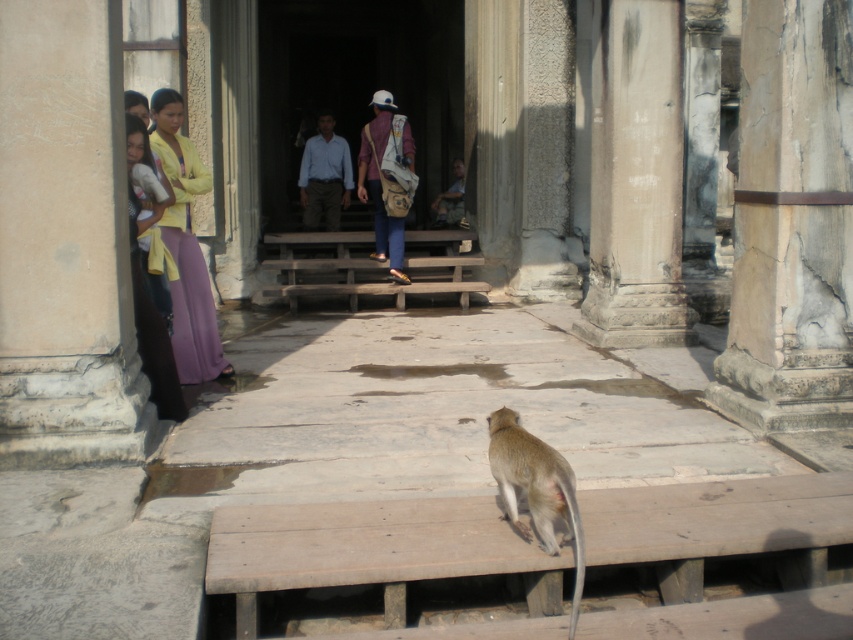
Does beige canvas backpack at center appear on the right side of matte yellow shirt at left?

Result: Indeed, beige canvas backpack at center is positioned on the right side of matte yellow shirt at left.

Describe the element at coordinates (387, 179) in the screenshot. I see `beige canvas backpack at center` at that location.

The height and width of the screenshot is (640, 853). In order to click on beige canvas backpack at center in this screenshot , I will do coord(387,179).

Is white stone column at right closer to the viewer compared to light brown fur monkey at lower center?

No, white stone column at right is behind light brown fur monkey at lower center.

Is point (764, 58) more distant than point (573, 605)?

Yes, it is.

The image size is (853, 640). What are the coordinates of `white stone column at right` in the screenshot? It's located at (791, 221).

Consider the image. Does beige stone pillar at upper left lie in front of purple silk pants at left?

Yes, it is.

Measure the distance from beige stone pillar at upper left to purple silk pants at left.

beige stone pillar at upper left and purple silk pants at left are 5.72 feet apart.

Where is `beige stone pillar at upper left`? The height and width of the screenshot is (640, 853). beige stone pillar at upper left is located at coordinates [x=65, y=243].